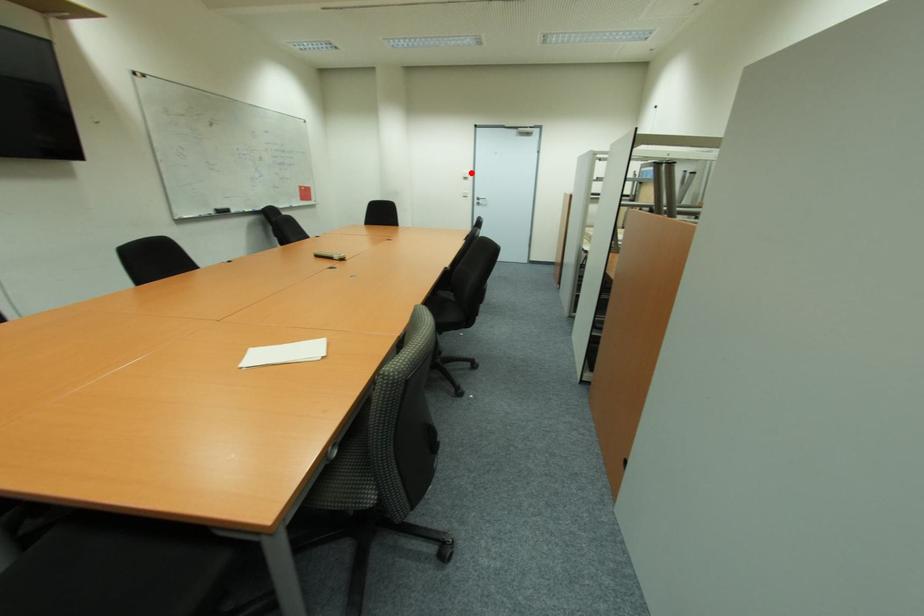
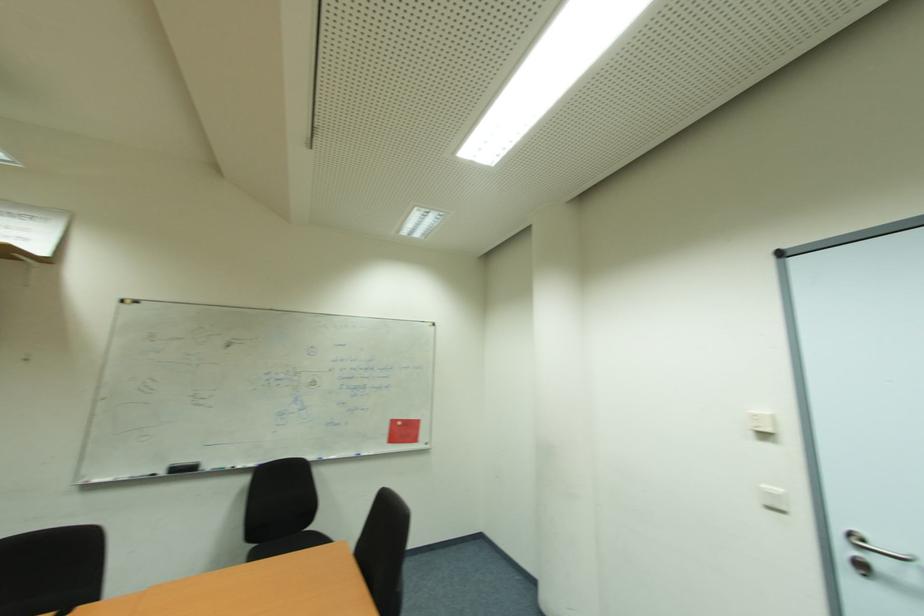
Question: I am providing you with two images of the same scene from different viewpoints. Given a red point in image1, look at the same physical point in image2. Is it:

Choices:
 (A) Closer to the viewpoint
 (B) Farther from the viewpoint

Answer: (B)